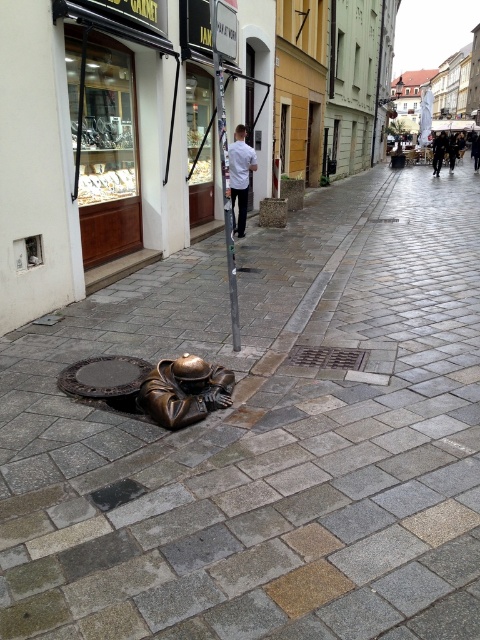
You are standing at the bronze statue of a person crouching near a manhole cover in the European town scene. You need to walk to a point that is behind the statue. Which of the two points, point (242, 173) or point (454, 161), should you go to?

Point (454, 161) is behind the bronze statue of a person crouching near a manhole cover because it is positioned behind point (242, 173), which is in front of it.

You are a delivery person trying to navigate through the cobblestone street. You need to avoid stepping on the bronze statue at lower center and the dark gray metallic manhole cover at lower left. Which object should you avoid stepping on first as you move forward?

The bronze statue at lower center is closer to the viewer than the dark gray metallic manhole cover at lower left, so you should avoid stepping on the bronze statue at lower center first as you move forward.

Looking at this image, you are a tourist holding a map and trying to locate the nearest restroom. You see a silver metallic pole at center and a dark gray fabric coat at upper right. According to the map, the restroom is located to the left of the coat. Which object should you head towards?

The silver metallic pole at center is positioned on the left side of dark gray fabric coat at upper right. Therefore, you should head towards the silver metallic pole at center since it is to the left of the coat, which aligns with the restroom location marked on the map.